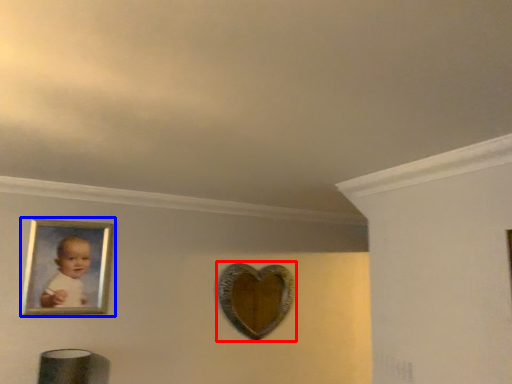
Question: Which point is further to the camera, mirror (highlighted by a red box) or picture frame (highlighted by a blue box)?

Choices:
 (A) mirror
 (B) picture frame

Answer: (A)